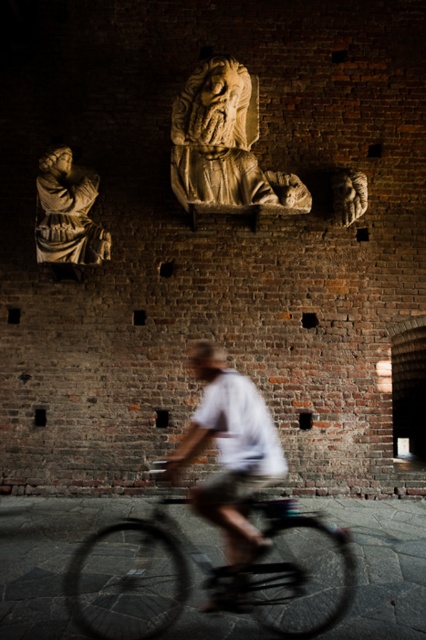
You are a photographer who wants to capture a clear photo of both the white matte shirt at center and the beige stone sculpture at upper center. Since the sculpture is taller than the shirt, which object will require you to adjust your camera focus to a greater distance?

The beige stone sculpture at upper center is taller than the white matte shirt at center, so you will need to adjust your camera focus to a greater distance for the beige stone sculpture at upper center.